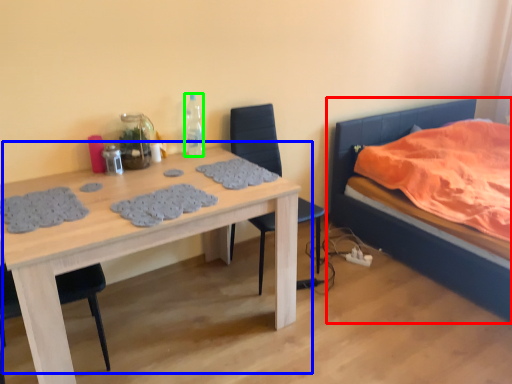
Question: Estimate the real-world distances between objects in this image. Which object is closer to bed (highlighted by a red box), table (highlighted by a blue box) or bottle (highlighted by a green box)?

Choices:
 (A) table
 (B) bottle

Answer: (B)